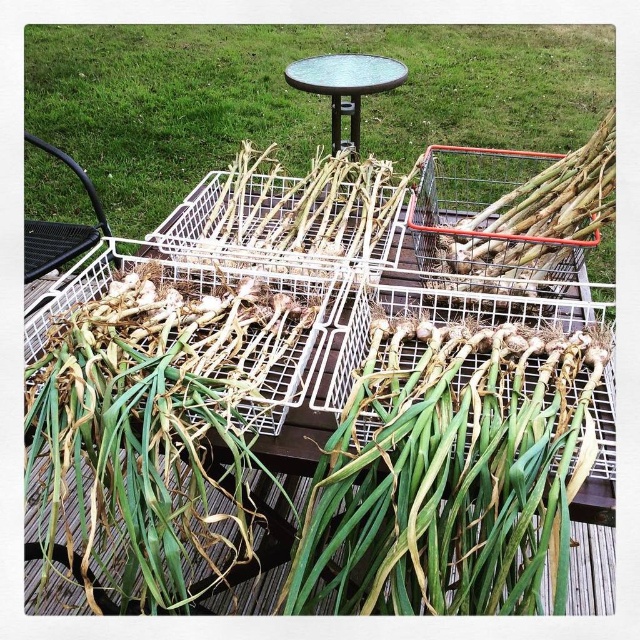
You are a gardener who wants to place a small potted plant on the green glass table at center. However, you notice the green leafy grass at center nearby. Which object is shorter so that the potted plant can be placed without obstruction?

The green leafy grass at center is shorter than the green glass table at center, so placing the potted plant on the green glass table at center won

You are standing in the garden looking at the green leafy grass at center and the green glass table at center. Which object is higher in position?

The green leafy grass at center is higher than the green glass table at center.

You are planning to place a 3 feet wide decorative pot between the green leafy grass at center and the green glass table at center. Is there enough space to fit it without moving either object?

The distance between the green leafy grass at center and the green glass table at center is 9.27 feet. Since the pot is 3 feet wide, there is sufficient space to place it between them without needing to move either object.